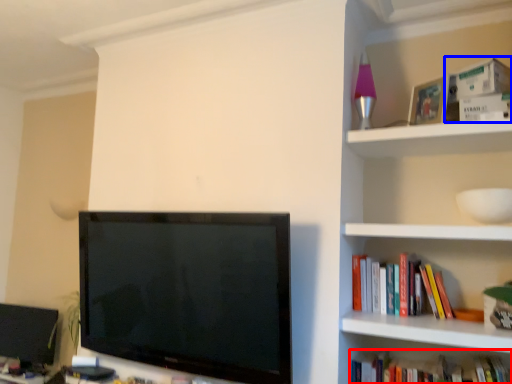
Question: Which of the following is the farthest to the observer, book (highlighted by a red box) or paperback book (highlighted by a blue box)?

Choices:
 (A) book
 (B) paperback book

Answer: (B)